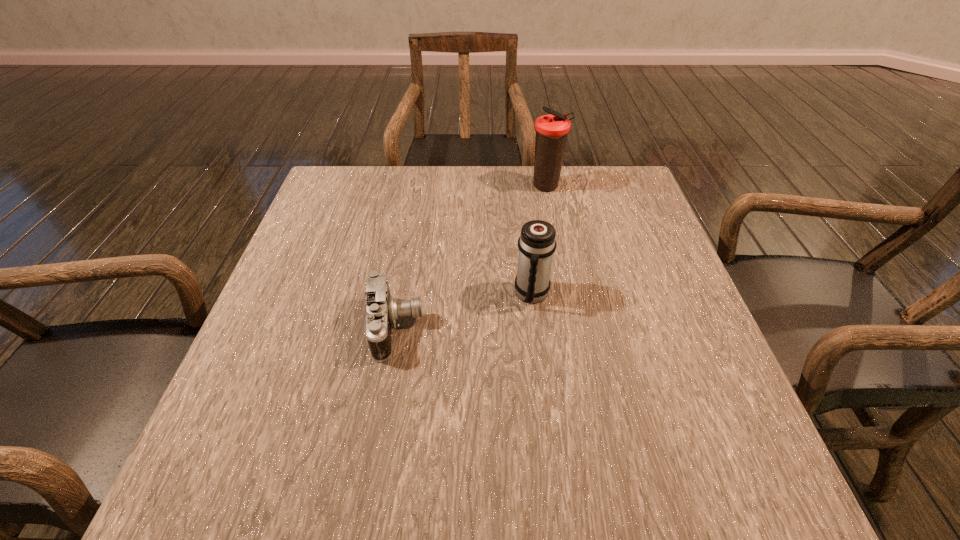
Identify the location of the farther thermos bottle. The image size is (960, 540). (x=551, y=130).

Where is `the taller thermos bottle`? The width and height of the screenshot is (960, 540). the taller thermos bottle is located at coordinates (551, 130).

This screenshot has height=540, width=960. I want to click on the shorter thermos bottle, so tap(537, 243).

Locate an element on the screen. The height and width of the screenshot is (540, 960). the second tallest object is located at coordinates (537, 243).

This screenshot has height=540, width=960. Identify the location of the shortest object. (382, 309).

This screenshot has width=960, height=540. What are the coordinates of `the leftmost object` in the screenshot? It's located at (382, 309).

Locate an element on the screen. vacant space located on the left of the farther thermos bottle is located at coordinates (504, 186).

I want to click on vacant space located 0.320m on the side with the handle of the shorter thermos bottle, so click(551, 466).

This screenshot has height=540, width=960. In order to click on vacant position located at the lens of the shortest object in this screenshot , I will do `click(499, 328)`.

Locate an element on the screen. object at the far edge is located at coordinates (551, 130).